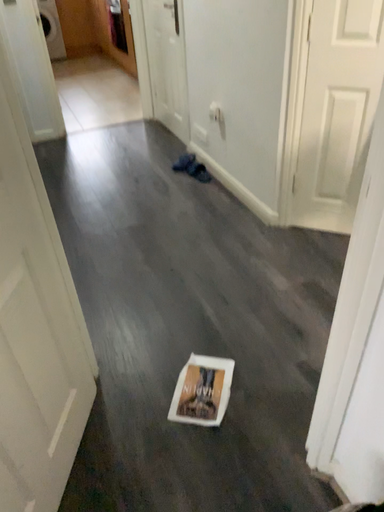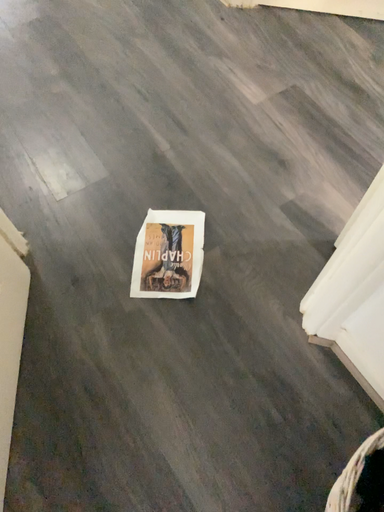
Question: Which way did the camera rotate in the video?

Choices:
 (A) rotated upward
 (B) rotated downward

Answer: (B)